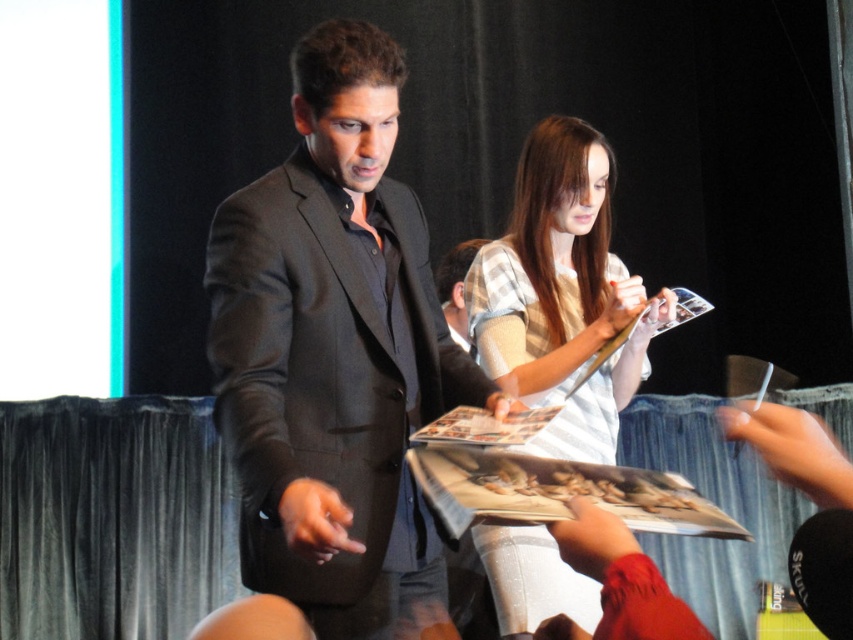
Can you confirm if matte black suit at center is taller than light beige plaid shirt at center?

No.

Which is more to the right, matte black suit at center or light beige plaid shirt at center?

Positioned to the right is light beige plaid shirt at center.

Is point (363, 294) closer to viewer compared to point (546, 196)?

Yes, it is.

I want to click on matte black suit at center, so click(x=334, y=353).